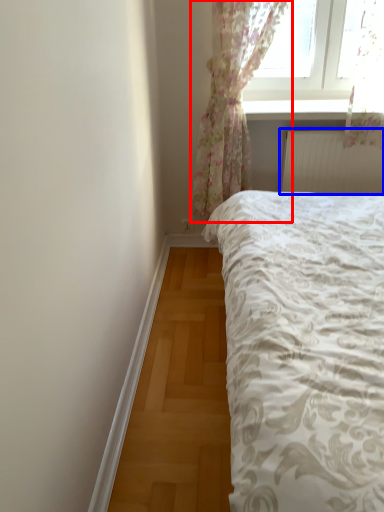
Question: Among these objects, which one is farthest to the camera, curtain (highlighted by a red box) or radiator (highlighted by a blue box)?

Choices:
 (A) curtain
 (B) radiator

Answer: (B)